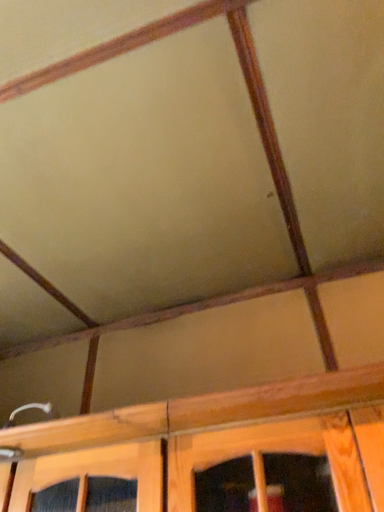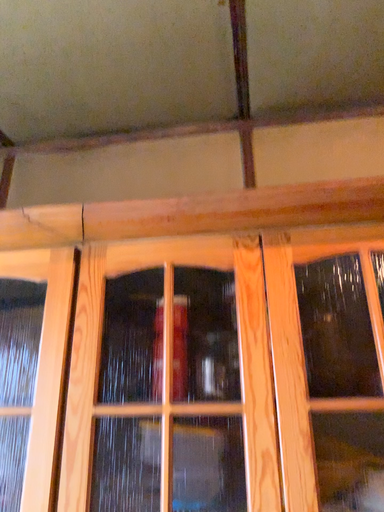
Question: How did the camera likely rotate when shooting the video?

Choices:
 (A) rotated left
 (B) rotated right

Answer: (B)